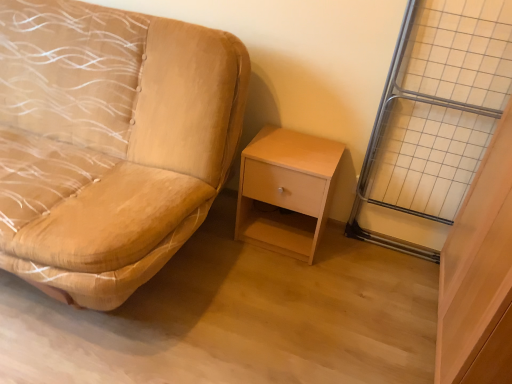
What are the coordinates of `vacant space that is in between light wood/finely finished nightstand at center-right and metal grid at right` in the screenshot? It's located at (358, 258).